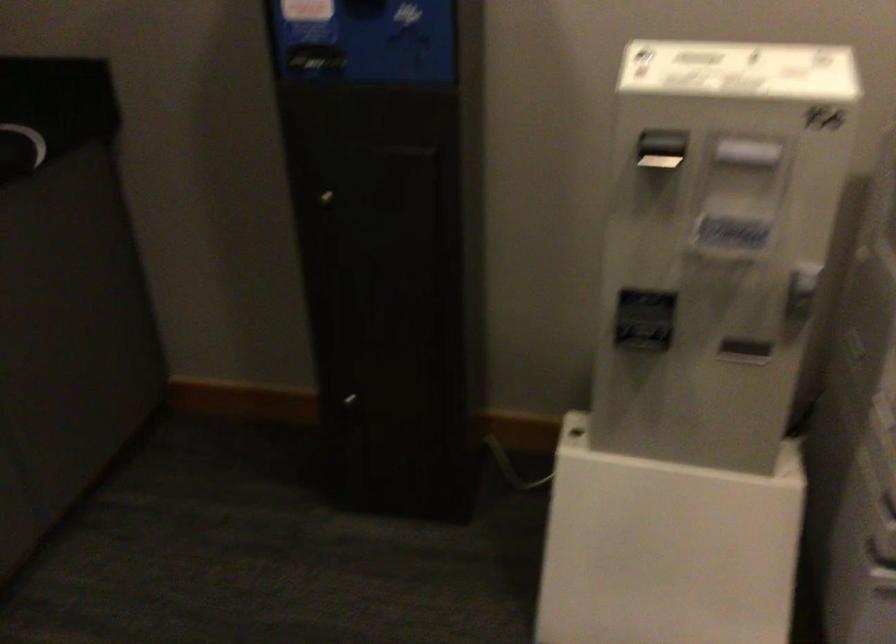
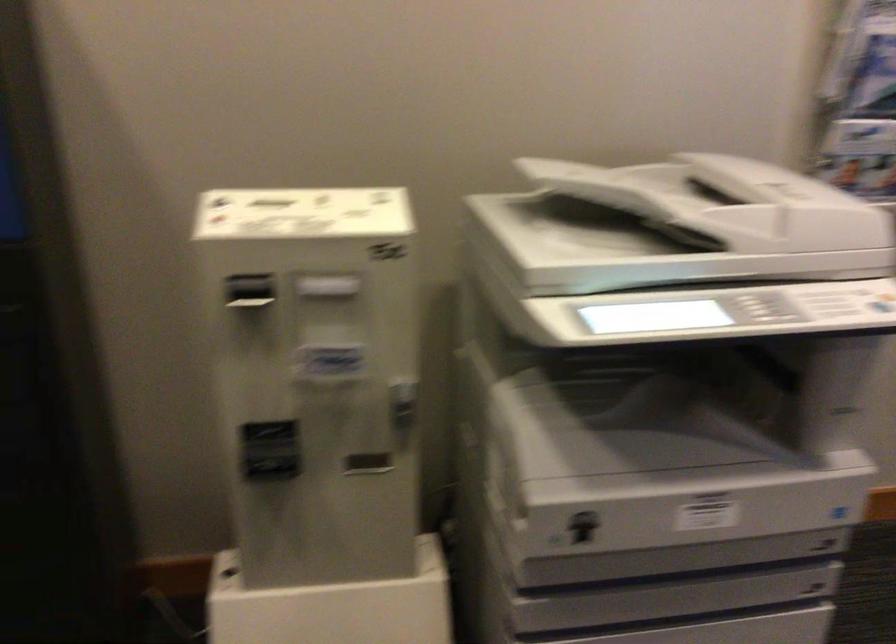
Locate, in the second image, the point that corresponds to (x=661, y=149) in the first image.

(250, 292)